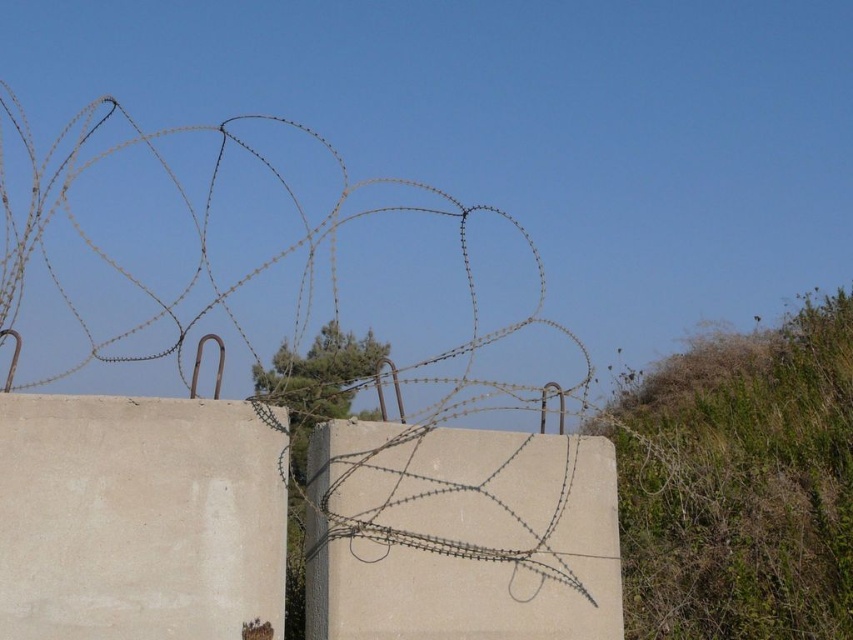
Can you confirm if gray concrete at center is taller than brown wire at upper center?

No, gray concrete at center is not taller than brown wire at upper center.

Locate an element on the screen. The height and width of the screenshot is (640, 853). gray concrete at center is located at coordinates (459, 534).

Can you confirm if beige concrete at center is positioned to the left of brown wire at upper center?

Indeed, beige concrete at center is positioned on the left side of brown wire at upper center.

Which is above, beige concrete at center or brown wire at upper center?

Positioned higher is brown wire at upper center.

This screenshot has width=853, height=640. In order to click on beige concrete at center in this screenshot , I will do `click(138, 516)`.

The height and width of the screenshot is (640, 853). In order to click on beige concrete at center in this screenshot , I will do `click(138, 516)`.

Is beige concrete at center shorter than gray concrete at center?

Indeed, beige concrete at center has a lesser height compared to gray concrete at center.

Does point (113, 451) come behind point (521, 532)?

No, (113, 451) is closer to viewer.

I want to click on beige concrete at center, so click(138, 516).